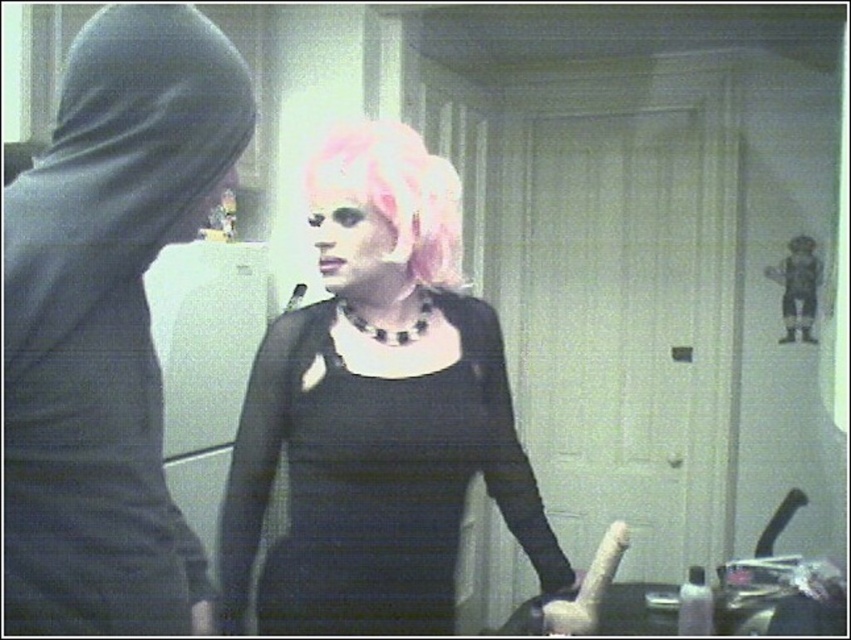
You are a photographer setting up a shoot in the described scene. You need to adjust the lighting so that both the matte black dress at center and the black matte hoodie at left are equally visible. Given their positions, which item requires more strategic lighting adjustments to highlight its details?

The black matte hoodie at left requires more strategic lighting adjustments because it is positioned farther from the viewer compared to the matte black dress at center, making it harder to capture details in the dim lighting.

You are organizing a clothing donation drive and need to determine which item takes up more space in the donation box. Based on the image, which item is bigger between the matte black dress at center and the black matte hoodie at left?

The matte black dress at center is larger in size than the black matte hoodie at left, so it takes up more space in the donation box.

You are a photographer setting up for a photoshoot in a dimly lit bathroom. You have a matte black dress at center that needs to be captured clearly. Considering the lighting conditions, what adjustment should you make to ensure the dress appears sharp and well lit in the photo?

Since the matte black dress at center is 3.75 feet away from the camera, you should adjust the camera settings to increase the exposure or use a flash to compensate for the low light, ensuring the dress is properly illuminated and in focus at that distance.